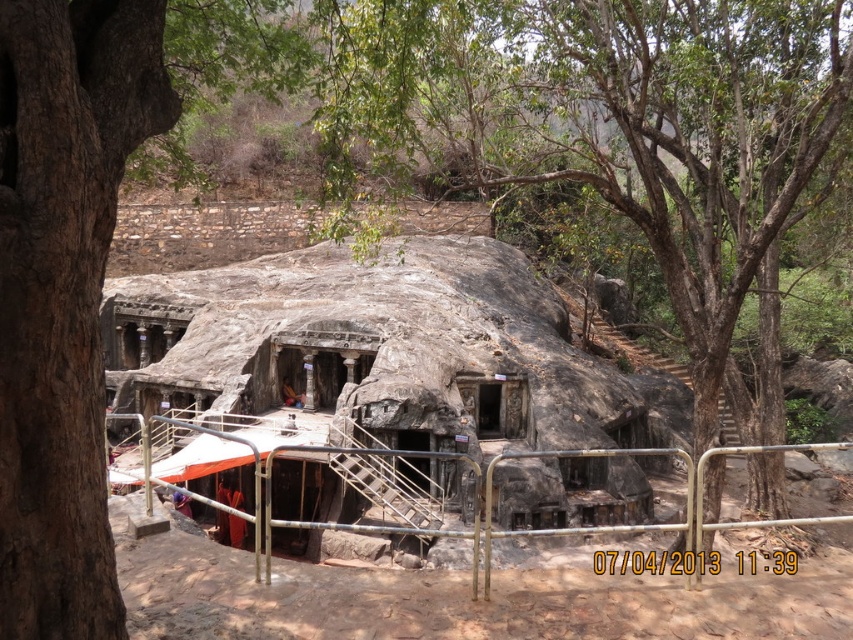
Consider the image. You are a visitor standing at the entrance of the natural stone cave at center and want to take a photo of the green leafy tree at center. Since the cave entrance is narrow, will you have to crouch down to avoid hitting your head while taking the photo?

The green leafy tree at center is taller than natural stone cave at center, so the cave entrance is shorter than the tree. Therefore, you will need to crouch down to avoid hitting your head while taking the photo.

You are standing at the point closest to the rock formation in the image. Which of the two points, point (x=387, y=1) or point (x=15, y=104), is farther away from you?

Point (x=387, y=1) is behind point (x=15, y=104), so it is farther away from you.

You are a visitor standing at the entrance of the historical rock temple. You see a green leafy tree at center and a brown rough tree trunk at left. Which tree is bigger in size?

The green leafy tree at center has a larger size compared to the brown rough tree trunk at left, so the green leafy tree at center is bigger in size.